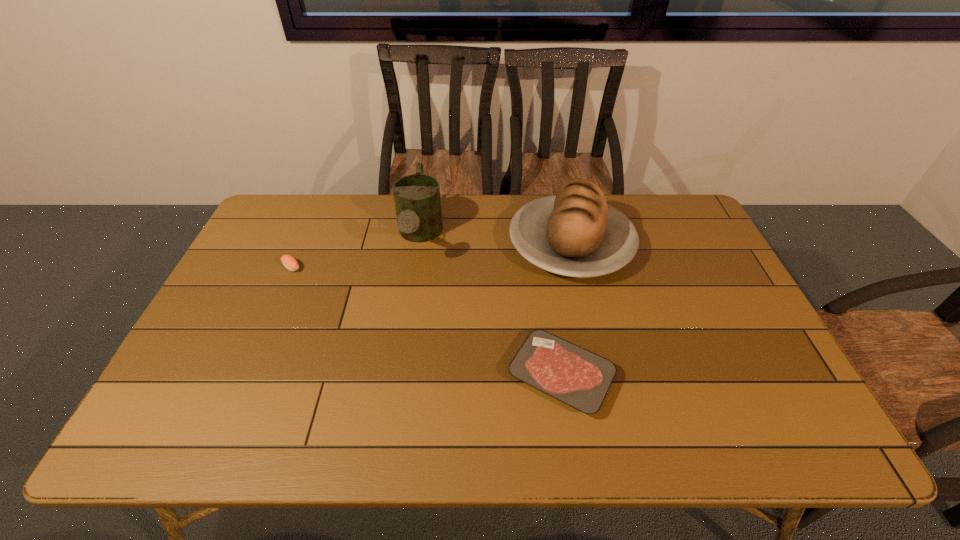
Locate an element on the screen. watering can that is at the far edge is located at coordinates (417, 200).

I want to click on bread that is at the far edge, so pyautogui.click(x=575, y=233).

This screenshot has width=960, height=540. I want to click on object present at the near edge, so click(x=578, y=377).

The image size is (960, 540). Find the location of `object present at the left edge`. object present at the left edge is located at coordinates (290, 263).

The image size is (960, 540). I want to click on free space at the far edge, so click(359, 202).

Identify the location of vacant region at the near edge of the desktop. (306, 433).

The image size is (960, 540). In the image, there is a desktop. What are the coordinates of `vacant region at the left edge` in the screenshot? It's located at (235, 281).

Find the location of a particular element. vacant space at the right edge is located at coordinates (752, 404).

Identify the location of free region at the far left corner of the desktop. (290, 211).

Identify the location of free space at the near left corner of the desktop. The image size is (960, 540). (204, 416).